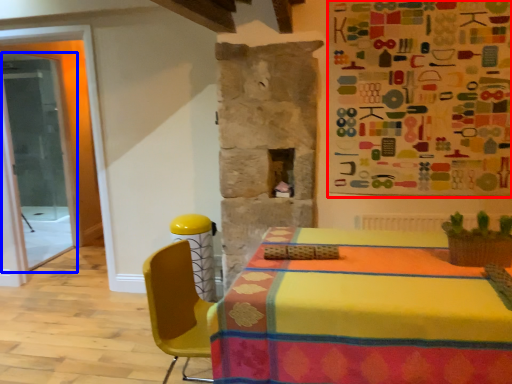
Question: Which object appears farthest to the camera in this image, bulletin board (highlighted by a red box) or glass door (highlighted by a blue box)?

Choices:
 (A) bulletin board
 (B) glass door

Answer: (B)